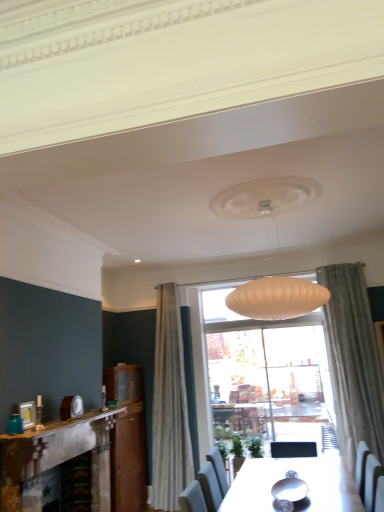
Question: In terms of height, does teal glass jar at left look taller or shorter compared to white marble fireplace at lower left?

Choices:
 (A) tall
 (B) short

Answer: (A)

Question: From the image's perspective, relative to white marble fireplace at lower left, is teal glass jar at left above or below?

Choices:
 (A) above
 (B) below

Answer: (A)

Question: Estimate the real-world distances between objects in this image. Which object is farther from the white marble fireplace at lower left?

Choices:
 (A) rustic stone fireplace at left
 (B) teal glass jar at left

Answer: (B)

Question: Estimate the real-world distances between objects in this image. Which object is closer to the white marble fireplace at lower left?

Choices:
 (A) teal glass jar at left
 (B) rustic stone fireplace at left

Answer: (B)